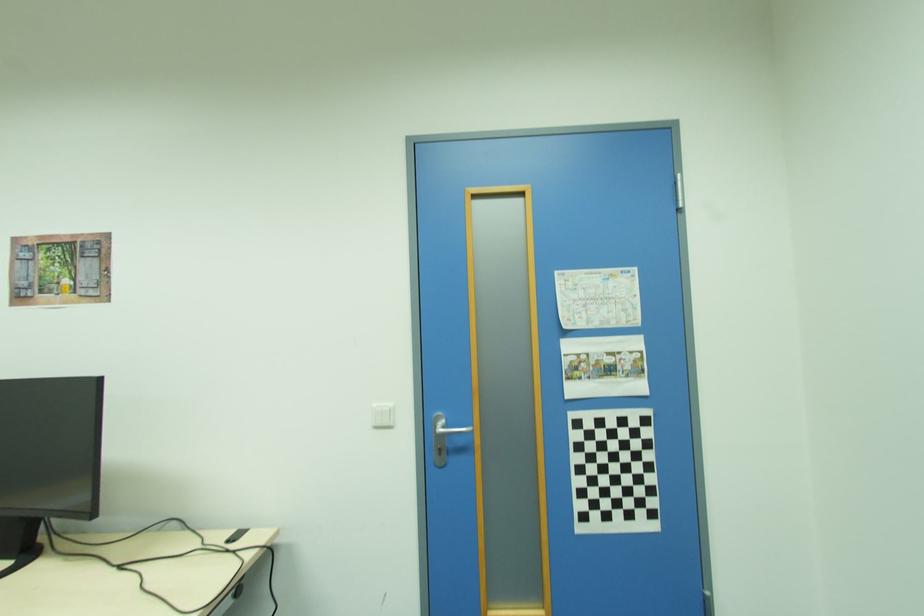
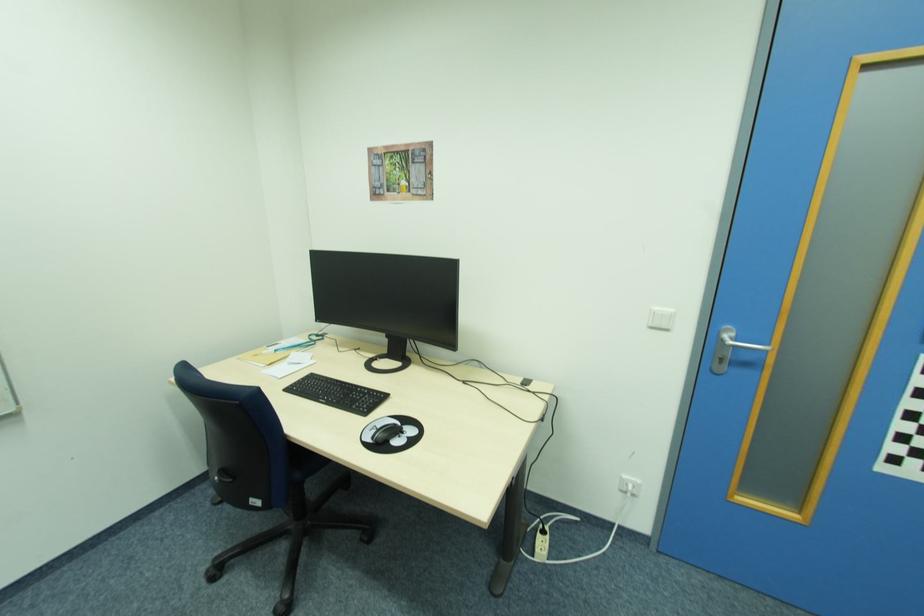
Locate, in the second image, the point that corresponds to (x=394, y=427) in the first image.

(670, 329)